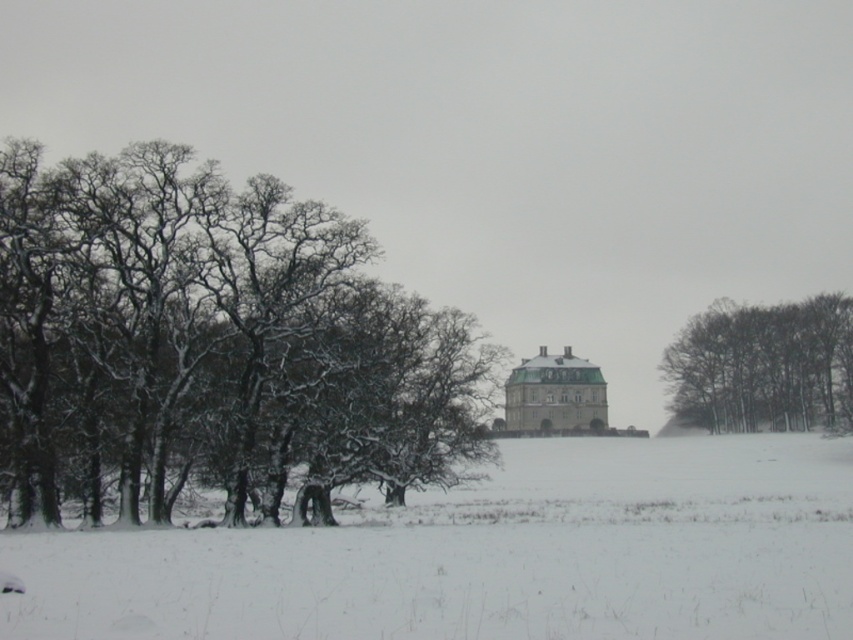
You are standing at the center of the image and want to place a small red flag at the exact location of the white fluffy snow at lower center. What are the coordinates where you should place the flag?

The coordinates for the white fluffy snow at lower center are at point (491, 556), so you should place the flag at those coordinates.

You are standing at the point marked as point (212, 346) in the winter landscape. Looking towards the mansion in the distance, which direction should you walk to reach the snow covered ground in the foreground?

Since the point is on snow covered bark trees at left, to reach the snow covered ground in the foreground, you should walk towards the right direction.